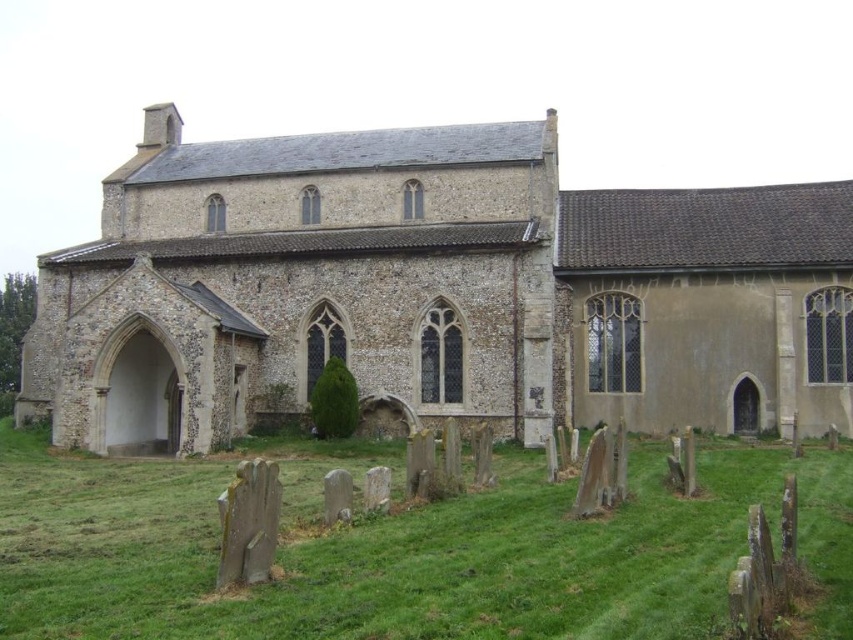
You are standing at the entrance of the historic stone church and want to locate two specific points marked in the image. The first point is at coordinates point (463, 145) and the second is at point (769, 468). From your current position, which point is closer to you?

Point (769, 468) is closer to you because it is in front of point (463, 145).

You are standing at the entrance of the stone church at lower left and want to walk towards the green grass at lower left. Is the path between them wide enough for a person to walk through comfortably?

The stone church at lower left might be wider than green grass at lower left, so the path between them may not be wide enough for a person to walk through comfortably.